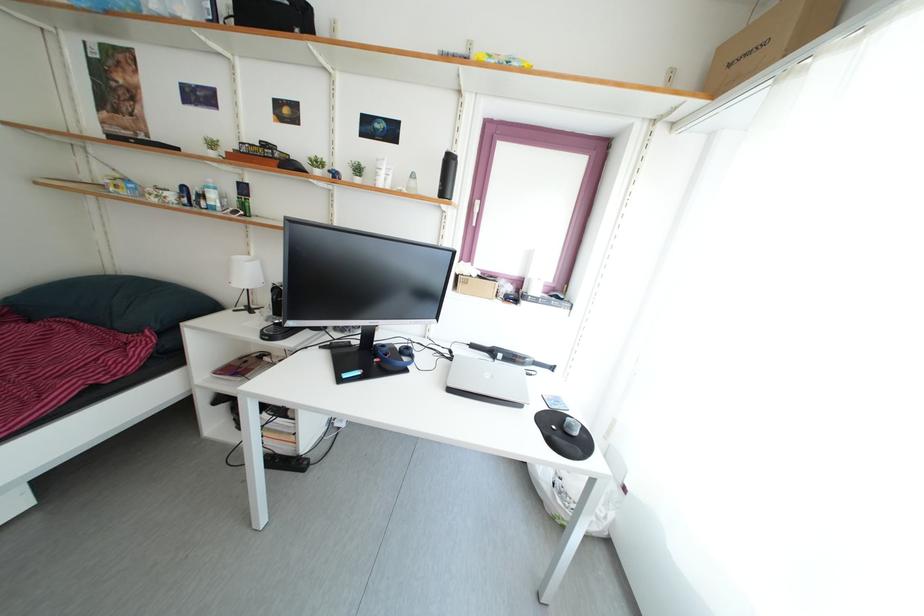
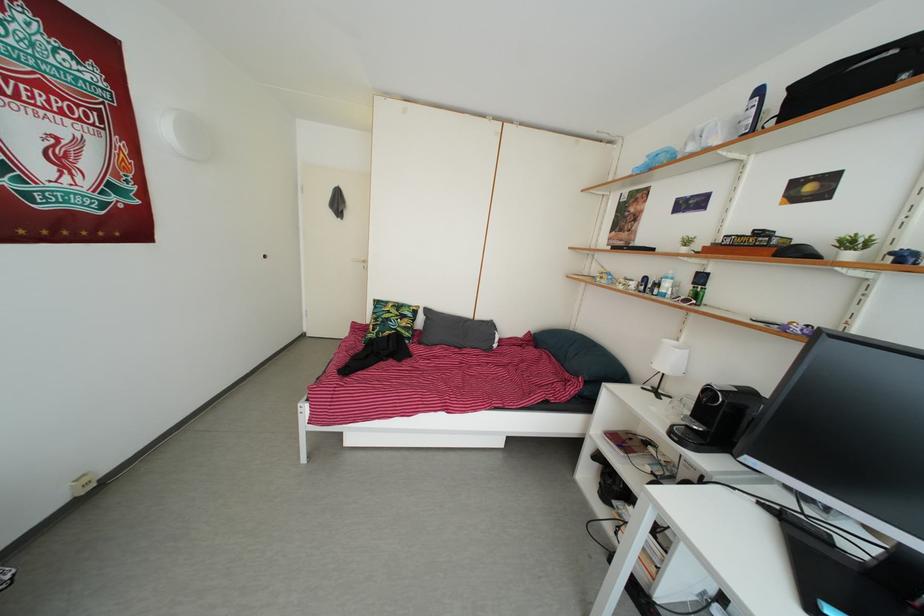
Where in the second image is the point corresponding to [174,201] from the first image?

(638, 291)